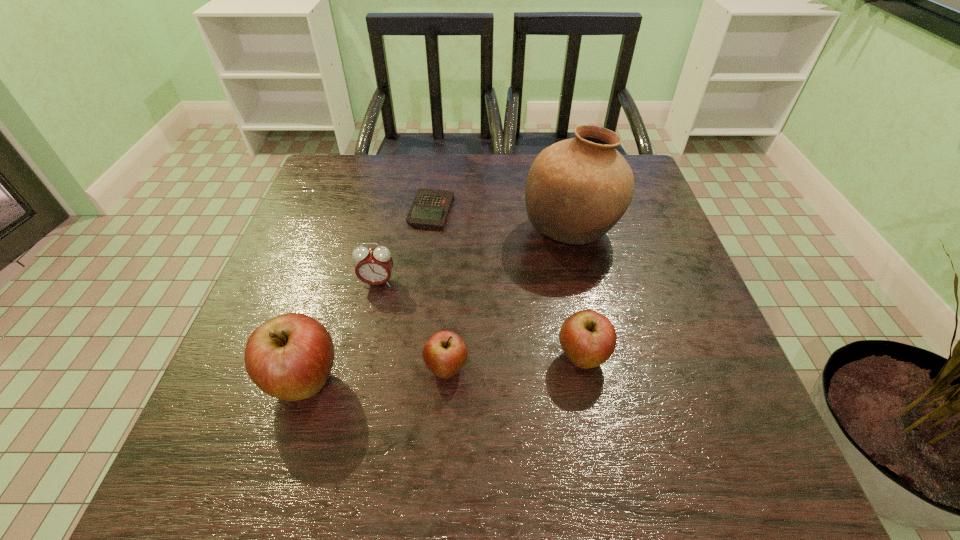
Identify the location of vacant region between the second shortest apple and the calculator. (507, 284).

At what (x,y) coordinates should I click in order to perform the action: click on vacant area that lies between the shortest apple and the pottery. Please return your answer as a coordinate pair (x, y). The width and height of the screenshot is (960, 540). Looking at the image, I should click on (509, 300).

Identify the location of the fifth closest object relative to the calculator. (588, 338).

I want to click on object that can be found as the third closest to the tallest object, so click(x=445, y=353).

Select which apple is the third closest to the calculator. Please provide its 2D coordinates. Your answer should be formatted as a tuple, i.e. [(x, y)], where the tuple contains the x and y coordinates of a point satisfying the conditions above.

[(588, 338)]

This screenshot has height=540, width=960. I want to click on the second closest apple relative to the shortest apple, so click(588, 338).

Identify the location of vacant space that satisfies the following two spatial constraints: 1. on the clock face of the shortest apple; 2. on the left side of the third farthest object. The image size is (960, 540). (359, 369).

Locate an element on the screen. free space that satisfies the following two spatial constraints: 1. on the front side of the shortest object; 2. on the left side of the shortest apple is located at coordinates (411, 369).